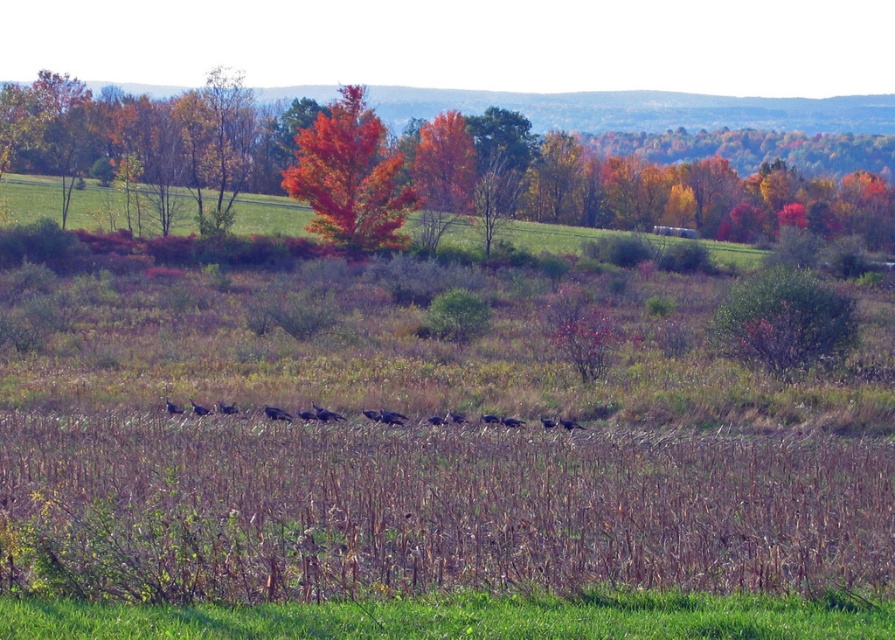
Question: Is orange leafy tree at upper center closer to camera compared to vivid orange leaves at center?

Choices:
 (A) no
 (B) yes

Answer: (A)

Question: Can you confirm if orange leafy tree at upper center is bigger than vivid orange leaves at center?

Choices:
 (A) no
 (B) yes

Answer: (B)

Question: Which object is closer to the camera taking this photo?

Choices:
 (A) orange leafy tree at upper center
 (B) vivid orange leaves at center

Answer: (B)

Question: Is orange leafy tree at upper center further to the viewer compared to vivid orange leaves at center?

Choices:
 (A) no
 (B) yes

Answer: (B)

Question: Which point is farther to the camera?

Choices:
 (A) vivid orange leaves at center
 (B) orange leafy tree at upper center

Answer: (B)